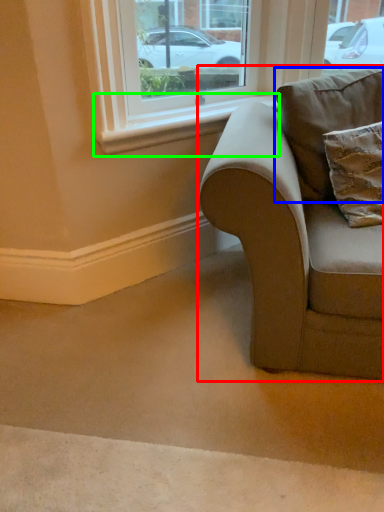
Question: Considering the real-world distances, which object is closest to studio couch (highlighted by a red box)? pillow (highlighted by a blue box) or window sill (highlighted by a green box).

Choices:
 (A) pillow
 (B) window sill

Answer: (A)